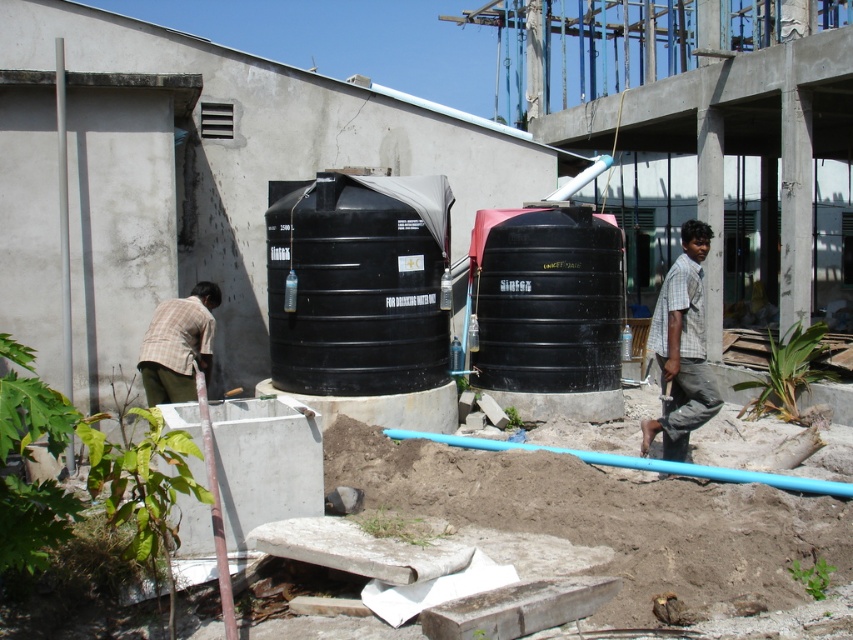
Based on the photo, you are a construction worker who needs to take a photo of the gray checkered shirt at right. You have a camera that has a maximum effective range of 7 meters. Can you capture a clear photo without moving closer?

The gray checkered shirt at right and camera are 7.19 meters apart from each other. Since the camera has a maximum effective range of 7 meters, you cannot capture a clear photo without moving closer.

You are a construction worker who needs to ensure safety by checking the height of the black matte water tank at center and the plaid shirt at left. Which object is taller?

The black matte water tank at center is taller than the plaid shirt at left according to the description.

Based on the coordinates provided in the scene description, where is the gray checkered shirt at right located in the image?

The gray checkered shirt at right is located at point (682, 348) in the image.